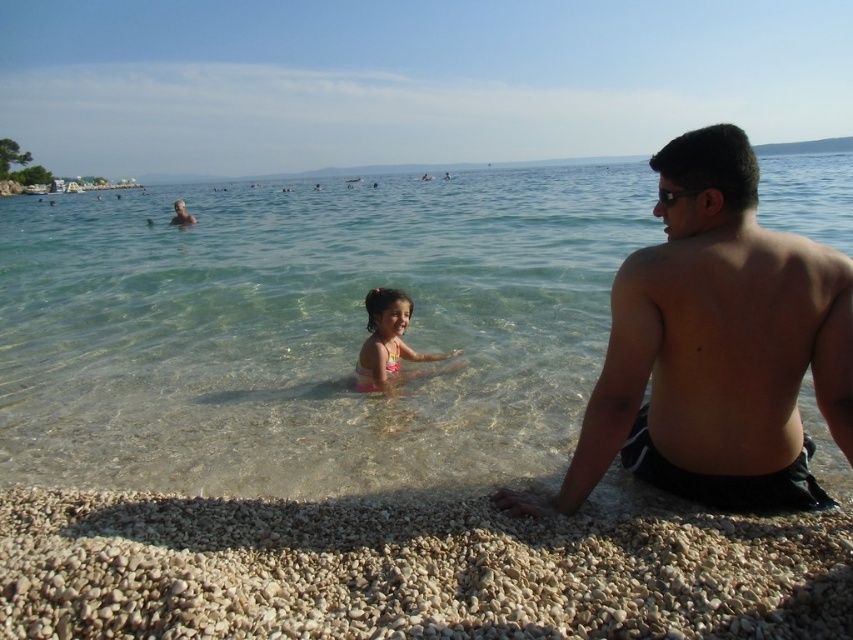
Between smooth pebble beach at lower center and smooth skin man at upper left, which one appears on the right side from the viewer's perspective?

From the viewer's perspective, smooth pebble beach at lower center appears more on the right side.

Does smooth pebble beach at lower center lie in front of smooth skin man at upper left?

Yes.

Is point (253, 625) closer to camera compared to point (173, 204)?

Yes, point (253, 625) is closer to viewer.

At what (x,y) coordinates should I click in order to perform the action: click on smooth pebble beach at lower center. Please return your answer as a coordinate pair (x, y). Looking at the image, I should click on (410, 570).

Who is taller, shiny black skin at lower right or pink fabric swimsuit at center?

With more height is shiny black skin at lower right.

This screenshot has height=640, width=853. Identify the location of shiny black skin at lower right. (715, 346).

Which is above, smooth pebble beach at lower center or pink fabric swimsuit at center?

pink fabric swimsuit at center is above.

Is smooth pebble beach at lower center thinner than pink fabric swimsuit at center?

In fact, smooth pebble beach at lower center might be wider than pink fabric swimsuit at center.

Who is more forward, (753, 627) or (370, 358)?

Point (753, 627)

Identify the location of smooth pebble beach at lower center. The width and height of the screenshot is (853, 640). (410, 570).